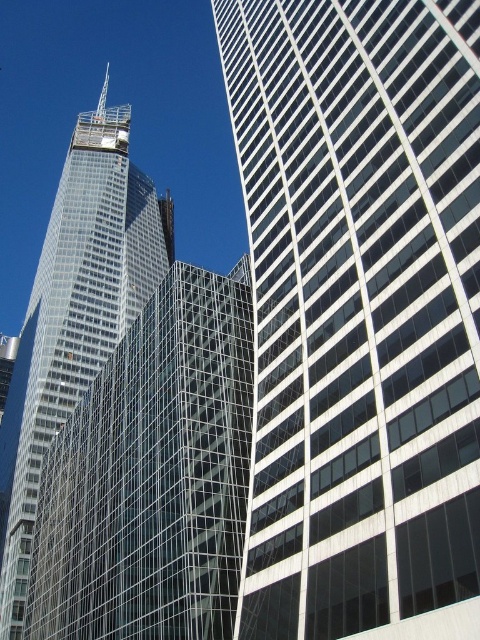
Can you confirm if glassy reflective skyscraper at right is positioned to the right of clear glass skyscraper at left?

Correct, you'll find glassy reflective skyscraper at right to the right of clear glass skyscraper at left.

Find the location of a particular element. Image resolution: width=480 pixels, height=640 pixels. glassy reflective skyscraper at right is located at coordinates pos(360,314).

You are a GUI agent. You are given a task and a screenshot of the screen. Output one action in this format:
    pyautogui.click(x=<x>, y=<y>)
    Task: Click on the glassy reflective skyscraper at right
    
    Given the screenshot: What is the action you would take?
    pyautogui.click(x=360, y=314)

Is glassy reflective skyscraper at right to the left of transparent glass building at center from the viewer's perspective?

Incorrect, glassy reflective skyscraper at right is not on the left side of transparent glass building at center.

Identify the location of glassy reflective skyscraper at right. The image size is (480, 640). (360, 314).

Does point (129, 342) come in front of point (85, 204)?

That is True.

Which of these two, transparent glass building at center or clear glass skyscraper at left, stands shorter?

transparent glass building at center

From the picture: Who is more forward, (159,586) or (52,314)?

Point (159,586) is more forward.

This screenshot has height=640, width=480. I want to click on transparent glass building at center, so click(153, 476).